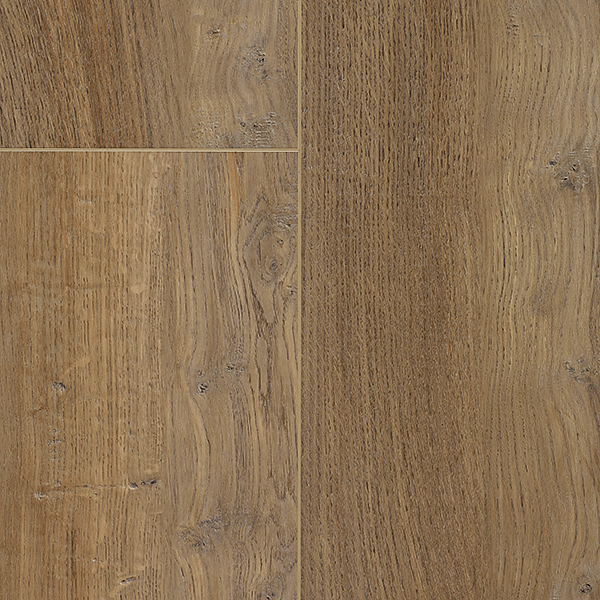
This screenshot has width=600, height=600. Identify the location of joint between wood panels. (275, 150), (298, 237), (300, 107).